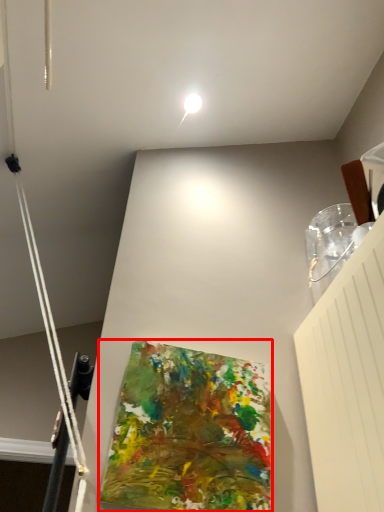
Question: Where is art (annotated by the red box) located in relation to droplight in the image?

Choices:
 (A) right
 (B) left

Answer: (A)